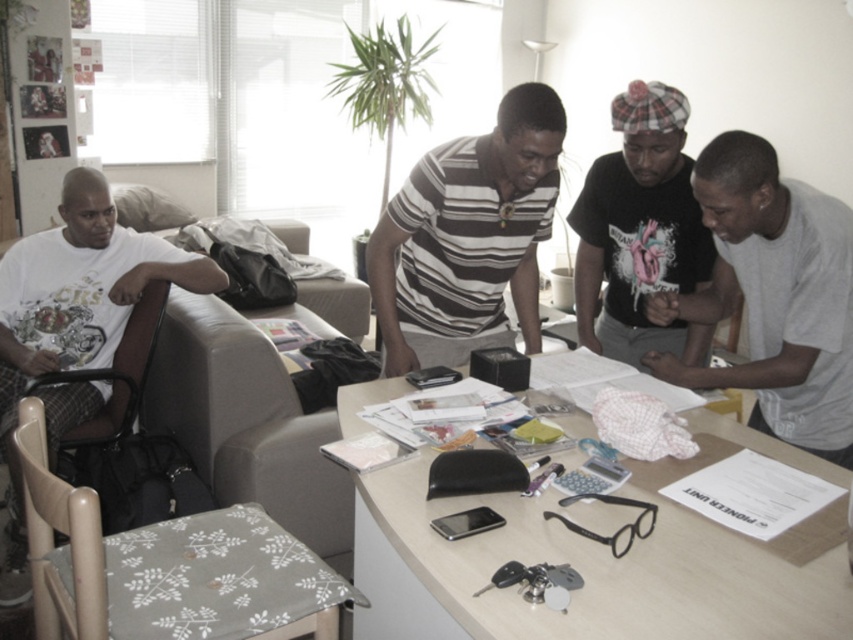
Does wooden table at center have a larger size compared to white cotton t-shirt at left?

Actually, wooden table at center might be smaller than white cotton t-shirt at left.

Who is taller, wooden table at center or white cotton t-shirt at left?

white cotton t-shirt at left

Where is `wooden table at center`? The height and width of the screenshot is (640, 853). wooden table at center is located at coordinates tap(583, 570).

Between wooden table at center and gray cotton shirt at center, which one is positioned lower?

wooden table at center is below.

Consider the image. Is wooden table at center closer to camera compared to gray cotton shirt at center?

Yes, it is in front of gray cotton shirt at center.

Is point (741, 596) positioned behind point (831, 432)?

No.

Identify the location of wooden table at center. Image resolution: width=853 pixels, height=640 pixels. (583, 570).

Who is higher up, striped cotton shirt at center or black matte shirt at center?

black matte shirt at center is higher up.

The image size is (853, 640). Describe the element at coordinates (468, 232) in the screenshot. I see `striped cotton shirt at center` at that location.

Locate an element on the screen. This screenshot has width=853, height=640. striped cotton shirt at center is located at coordinates (468, 232).